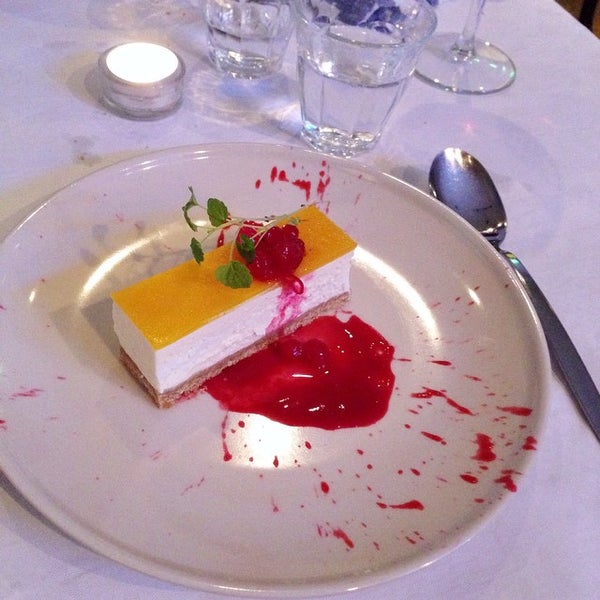
Where is `water glass`? water glass is located at coordinates (254, 27), (347, 82).